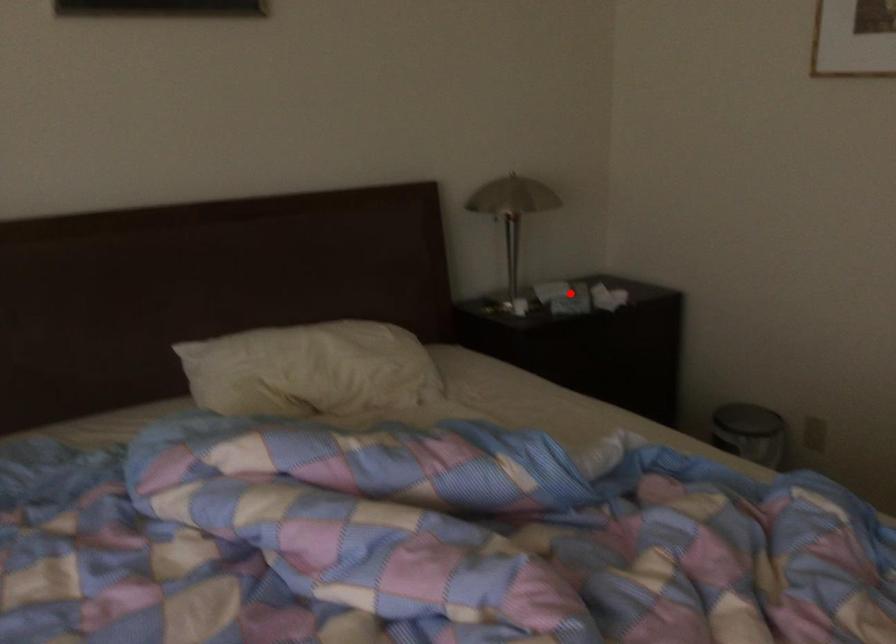
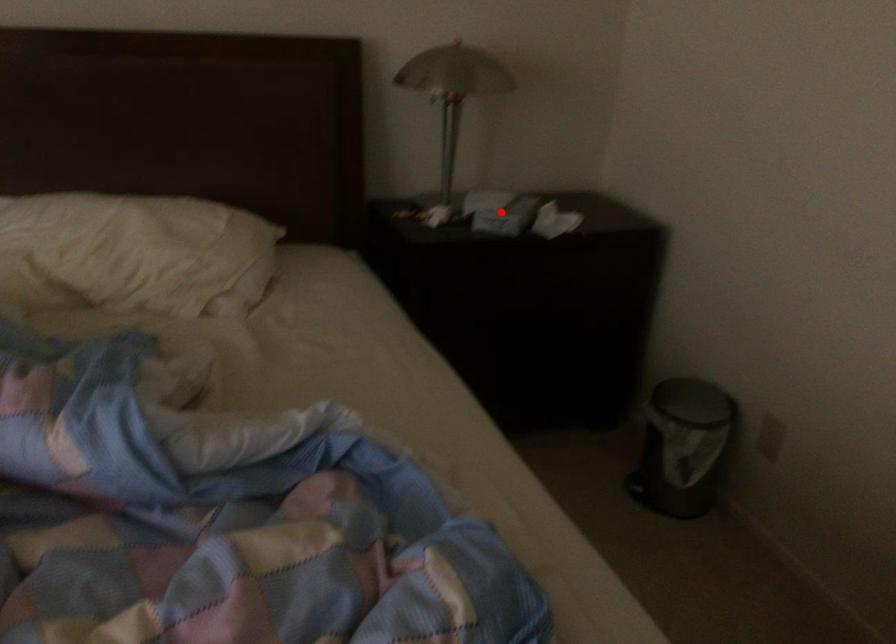
I am providing you with two images of the same scene from different viewpoints. A red point is marked on the first image and another point is marked on the second image. Are the points marked in image1 and image2 representing the same 3D position?

Yes